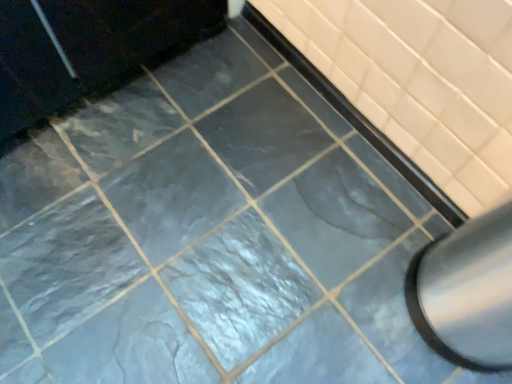
The height and width of the screenshot is (384, 512). What do you see at coordinates (420, 79) in the screenshot?
I see `matte black bathtub at center` at bounding box center [420, 79].

What is the approximate width of matte black bathtub at center?

The width of matte black bathtub at center is 1.18 inches.

Locate an element on the screen. The width and height of the screenshot is (512, 384). matte black bathtub at center is located at coordinates (420, 79).

In order to click on satin silver exhaust hood at lower right in this screenshot , I will do `click(466, 292)`.

What do you see at coordinates (466, 292) in the screenshot? The height and width of the screenshot is (384, 512). I see `satin silver exhaust hood at lower right` at bounding box center [466, 292].

This screenshot has width=512, height=384. I want to click on matte black bathtub at center, so click(420, 79).

Does satin silver exhaust hood at lower right appear on the right side of matte black bathtub at center?

Indeed, satin silver exhaust hood at lower right is positioned on the right side of matte black bathtub at center.

Which object is further away from the camera, satin silver exhaust hood at lower right or matte black bathtub at center?

matte black bathtub at center is more distant.

Which is closer, (498,297) or (443,15)?

Clearly, point (498,297) is closer to the camera than point (443,15).

From the image's perspective, is satin silver exhaust hood at lower right under matte black bathtub at center?

Correct, satin silver exhaust hood at lower right appears lower than matte black bathtub at center in the image.

From a real-world perspective, between satin silver exhaust hood at lower right and matte black bathtub at center, who is vertically lower?

Result: matte black bathtub at center, from a real-world perspective.

Which of these two, satin silver exhaust hood at lower right or matte black bathtub at center, is wider?

satin silver exhaust hood at lower right is wider.

Is satin silver exhaust hood at lower right taller or shorter than matte black bathtub at center?

satin silver exhaust hood at lower right is taller than matte black bathtub at center.

Does satin silver exhaust hood at lower right have a smaller size compared to matte black bathtub at center?

No, satin silver exhaust hood at lower right is not smaller than matte black bathtub at center.

Would you say satin silver exhaust hood at lower right is outside matte black bathtub at center?

Yes.

Is satin silver exhaust hood at lower right next to matte black bathtub at center?

They are not placed beside each other.

Is satin silver exhaust hood at lower right positioned with its back to matte black bathtub at center?

satin silver exhaust hood at lower right does not have its back to matte black bathtub at center.

Can you tell me how much satin silver exhaust hood at lower right and matte black bathtub at center differ in facing direction?

The angular difference between satin silver exhaust hood at lower right and matte black bathtub at center is 0.766 degrees.

Locate an element on the screen. exhaust hood that is below the matte black bathtub at center (from the image's perspective) is located at coordinates click(466, 292).

Considering the relative positions of matte black bathtub at center and satin silver exhaust hood at lower right in the image provided, is matte black bathtub at center to the left or to the right of satin silver exhaust hood at lower right?

matte black bathtub at center is positioned on satin silver exhaust hood at lower right's left side.

Is the position of matte black bathtub at center less distant than that of satin silver exhaust hood at lower right?

No, it is behind satin silver exhaust hood at lower right.

Is point (495, 96) farther from viewer compared to point (487, 279)?

That is True.

From the image's perspective, does matte black bathtub at center appear lower than satin silver exhaust hood at lower right?

No, from the image's perspective, matte black bathtub at center is not below satin silver exhaust hood at lower right.

From a real-world perspective, who is located lower, matte black bathtub at center or satin silver exhaust hood at lower right?

matte black bathtub at center is physically lower.

Is matte black bathtub at center thinner than satin silver exhaust hood at lower right?

Indeed, matte black bathtub at center has a lesser width compared to satin silver exhaust hood at lower right.

Between matte black bathtub at center and satin silver exhaust hood at lower right, which one has less height?

Standing shorter between the two is matte black bathtub at center.

Does matte black bathtub at center have a larger size compared to satin silver exhaust hood at lower right?

No, matte black bathtub at center is not bigger than satin silver exhaust hood at lower right.

Would you say matte black bathtub at center is inside or outside satin silver exhaust hood at lower right?

matte black bathtub at center is located beyond the bounds of satin silver exhaust hood at lower right.

Are matte black bathtub at center and satin silver exhaust hood at lower right making contact?

No, matte black bathtub at center is not with satin silver exhaust hood at lower right.

Is matte black bathtub at center oriented towards satin silver exhaust hood at lower right?

No, matte black bathtub at center is not oriented towards satin silver exhaust hood at lower right.

Can you tell me how much matte black bathtub at center and satin silver exhaust hood at lower right differ in facing direction?

0.766 degrees separate the facing orientations of matte black bathtub at center and satin silver exhaust hood at lower right.

Measure the distance between matte black bathtub at center and satin silver exhaust hood at lower right.

matte black bathtub at center and satin silver exhaust hood at lower right are 12.37 inches apart from each other.

I want to click on bath that appears below the satin silver exhaust hood at lower right (from a real-world perspective), so click(420, 79).

The width and height of the screenshot is (512, 384). What are the coordinates of `bath located on the left of satin silver exhaust hood at lower right` in the screenshot? It's located at (420, 79).

The image size is (512, 384). In order to click on exhaust hood on the right of matte black bathtub at center in this screenshot , I will do `click(466, 292)`.